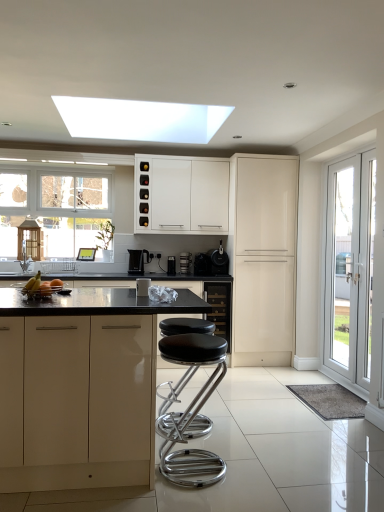
Image resolution: width=384 pixels, height=512 pixels. What are the coordinates of `free space above wooden door at left, positioned as the second door in front-to-back order (from a real-world perspective)` in the screenshot? It's located at (37, 214).